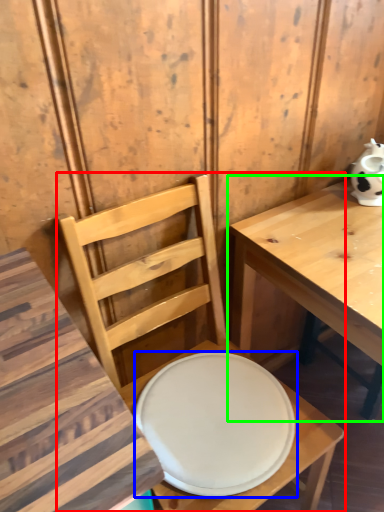
Question: Which is farther away from chair (highlighted by a red box)? plate (highlighted by a blue box) or table (highlighted by a green box)?

Choices:
 (A) plate
 (B) table

Answer: (B)